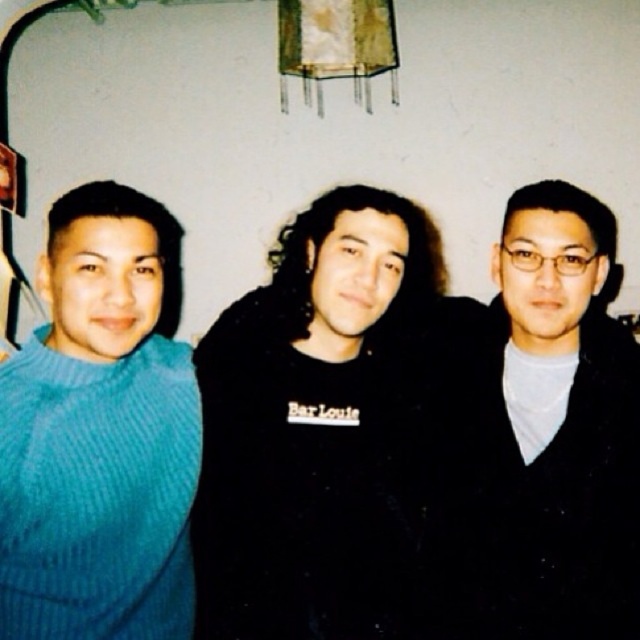
How much distance is there between black matte sweater at center and corduroy blue sweater at left?

A distance of 27.16 inches exists between black matte sweater at center and corduroy blue sweater at left.

Can you confirm if black matte sweater at center is taller than corduroy blue sweater at left?

Indeed, black matte sweater at center has a greater height compared to corduroy blue sweater at left.

The height and width of the screenshot is (640, 640). Find the location of `black matte sweater at center`. black matte sweater at center is located at coordinates (541, 435).

Is black matte shirt at center shorter than black matte sweater at center?

No, black matte shirt at center is not shorter than black matte sweater at center.

The image size is (640, 640). What do you see at coordinates (316, 428) in the screenshot?
I see `black matte shirt at center` at bounding box center [316, 428].

Does point (314, 564) lie behind point (600, 396)?

No, (314, 564) is closer to viewer.

Locate an element on the screen. This screenshot has width=640, height=640. black matte shirt at center is located at coordinates (316, 428).

Consider the image. Is black matte shirt at center shorter than corduroy blue sweater at left?

No.

Is black matte shirt at center to the right of corduroy blue sweater at left from the viewer's perspective?

Yes, black matte shirt at center is to the right of corduroy blue sweater at left.

Locate an element on the screen. black matte shirt at center is located at coordinates (316, 428).